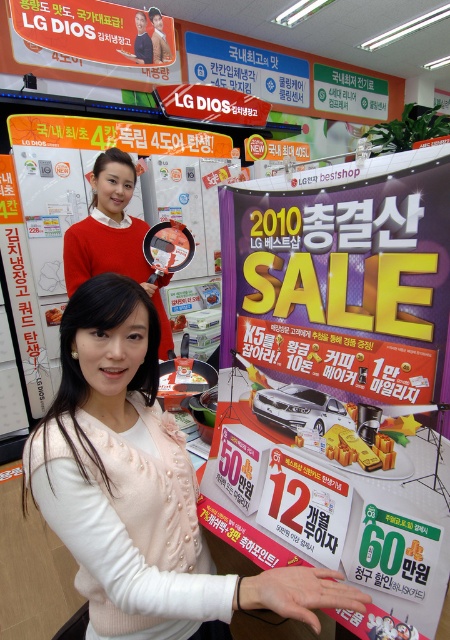
Question: Among these objects, which one is nearest to the camera?

Choices:
 (A) pearl white sweater at center
 (B) matte red sweater at upper left

Answer: (A)

Question: Which point appears farthest from the camera in this image?

Choices:
 (A) (140, 419)
 (B) (95, 216)

Answer: (B)

Question: Which object is closer to the camera taking this photo?

Choices:
 (A) pearl white sweater at center
 (B) matte red sweater at upper left

Answer: (A)

Question: Is pearl white sweater at center to the left of matte red sweater at upper left from the viewer's perspective?

Choices:
 (A) no
 (B) yes

Answer: (A)

Question: Considering the relative positions of pearl white sweater at center and matte red sweater at upper left in the image provided, where is pearl white sweater at center located with respect to matte red sweater at upper left?

Choices:
 (A) left
 (B) right

Answer: (B)

Question: Is pearl white sweater at center positioned before matte red sweater at upper left?

Choices:
 (A) yes
 (B) no

Answer: (A)